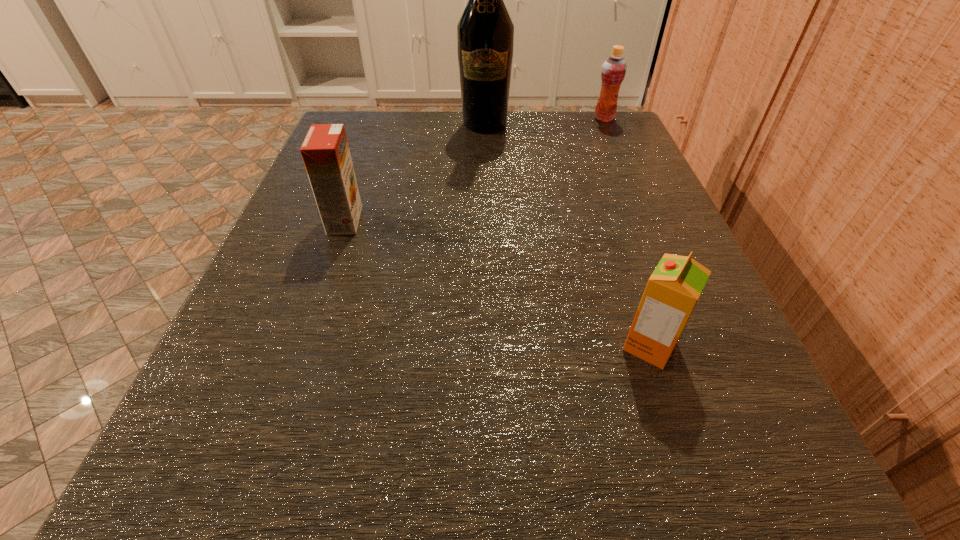
The image size is (960, 540). I want to click on the tallest object, so click(485, 33).

Locate an element on the screen. This screenshot has width=960, height=540. wine bottle is located at coordinates (485, 33).

This screenshot has width=960, height=540. What are the coordinates of `the farthest orange juice` in the screenshot? It's located at tap(614, 68).

Where is `the rightmost orange juice`? The height and width of the screenshot is (540, 960). the rightmost orange juice is located at coordinates (614, 68).

Where is `the third farthest object`? the third farthest object is located at coordinates (325, 151).

Where is `the second nearest orange juice`? This screenshot has height=540, width=960. the second nearest orange juice is located at coordinates (325, 151).

Find the location of a particular element. the nearest object is located at coordinates (673, 289).

At what (x,y) coordinates should I click in order to perform the action: click on the second orange juice from left to right. Please return your answer as a coordinate pair (x, y). This screenshot has width=960, height=540. Looking at the image, I should click on (673, 289).

Where is `vacant region located on the label of the wine bottle`? vacant region located on the label of the wine bottle is located at coordinates (486, 151).

At what (x,y) coordinates should I click in order to perform the action: click on vacant space located on the left of the rightmost object. Please return your answer as a coordinate pair (x, y). The image size is (960, 540). Looking at the image, I should click on (499, 118).